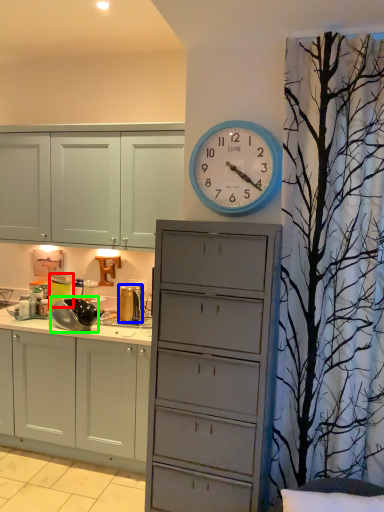
Question: Estimate the real-world distances between objects in this image. Which object is closer to appliance (highlighted by a red box), appliance (highlighted by a blue box) or appliance (highlighted by a green box)?

Choices:
 (A) appliance
 (B) appliance

Answer: (B)